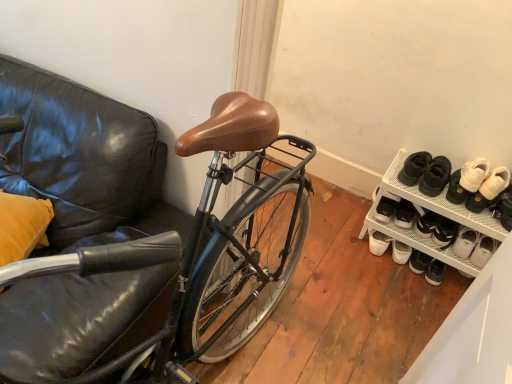
Question: Considering the relative sizes of white mesh shoe rack at lower right and white leather shoe at lower right in the image provided, is white mesh shoe rack at lower right thinner than white leather shoe at lower right?

Choices:
 (A) no
 (B) yes

Answer: (A)

Question: From a real-world perspective, is white mesh shoe rack at lower right located beneath white leather shoe at lower right?

Choices:
 (A) no
 (B) yes

Answer: (B)

Question: From the image's perspective, is white mesh shoe rack at lower right below white leather shoe at lower right?

Choices:
 (A) yes
 (B) no

Answer: (A)

Question: Is white mesh shoe rack at lower right next to white leather shoe at lower right?

Choices:
 (A) no
 (B) yes

Answer: (A)

Question: Can you confirm if white mesh shoe rack at lower right is shorter than white leather shoe at lower right?

Choices:
 (A) yes
 (B) no

Answer: (B)

Question: Looking at the image, does white leather shoe at lower right seem bigger or smaller compared to white suede sneakers at upper right, which is the second footwear in right-to-left order?

Choices:
 (A) small
 (B) big

Answer: (A)

Question: Does point pos(498,198) appear closer or farther from the camera than point pos(485,160)?

Choices:
 (A) farther
 (B) closer

Answer: (B)

Question: Do you think white leather shoe at lower right is within white suede sneakers at upper right, which is the second footwear in right-to-left order, or outside of it?

Choices:
 (A) outside
 (B) inside

Answer: (A)

Question: Relative to white suede sneakers at upper right, which is the second footwear in right-to-left order, is white leather shoe at lower right in front or behind?

Choices:
 (A) behind
 (B) front

Answer: (B)

Question: Considering the positions of white suede sneakers at right, marked as the 2th footwear in a left-to-right arrangement, and white suede sneakers at upper right, which is the second footwear in right-to-left order, in the image, is white suede sneakers at right, marked as the 2th footwear in a left-to-right arrangement, wider or thinner than white suede sneakers at upper right, which is the second footwear in right-to-left order,?

Choices:
 (A) wide
 (B) thin

Answer: (A)

Question: Visually, is white suede sneakers at right, marked as the 2th footwear in a left-to-right arrangement, positioned to the left or to the right of white suede sneakers at upper right, which is the second footwear in right-to-left order?

Choices:
 (A) right
 (B) left

Answer: (A)

Question: Is white suede sneakers at right, marked as the first footwear in a right-to-left arrangement, bigger or smaller than white suede sneakers at upper right, the 1th footwear when ordered from left to right?

Choices:
 (A) big
 (B) small

Answer: (B)

Question: From a real-world perspective, relative to white suede sneakers at upper right, which is the second footwear in right-to-left order, is white suede sneakers at right, marked as the first footwear in a right-to-left arrangement, vertically above or below?

Choices:
 (A) above
 (B) below

Answer: (A)

Question: Looking at their shapes, would you say white mesh shoe rack at lower right is wider or thinner than white suede sneakers at right, marked as the first footwear in a right-to-left arrangement?

Choices:
 (A) wide
 (B) thin

Answer: (A)

Question: Is white mesh shoe rack at lower right in front of or behind white suede sneakers at right, marked as the 2th footwear in a left-to-right arrangement, in the image?

Choices:
 (A) behind
 (B) front

Answer: (B)